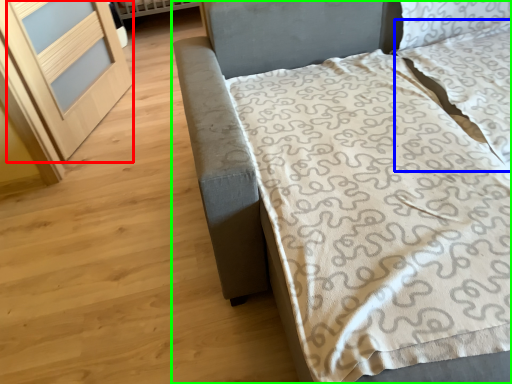
Question: Considering the real-world distances, which object is closest to screen door (highlighted by a red box)? pillow (highlighted by a blue box) or bed (highlighted by a green box).

Choices:
 (A) pillow
 (B) bed

Answer: (B)